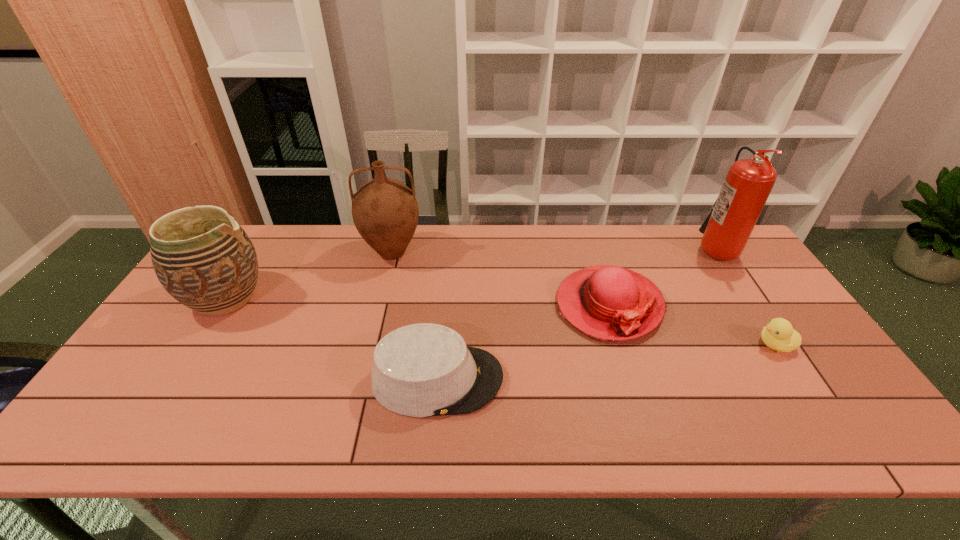
Locate an element on the screen. This screenshot has width=960, height=540. free region located 0.150m on the right of the pitcher is located at coordinates (468, 253).

Identify the location of free space located 0.240m on the front of the third tallest object. The image size is (960, 540). (159, 404).

Identify the location of free space located 0.050m at the front of the right hat with a bow. The image size is (960, 540). (626, 361).

You are a GUI agent. You are given a task and a screenshot of the screen. Output one action in this format:
    pyautogui.click(x=<x>, y=<y>)
    Task: Click on the free spot located 0.110m on the front-facing side of the left hat
    
    Given the screenshot: What is the action you would take?
    pyautogui.click(x=548, y=379)

Locate an element on the screen. This screenshot has width=960, height=540. vacant space situated 0.290m at the beak of the shortest object is located at coordinates (647, 345).

Find the location of `free location located at the beak of the shortest object`. free location located at the beak of the shortest object is located at coordinates (719, 345).

Where is `vacant space located at the beak of the shortest object`? vacant space located at the beak of the shortest object is located at coordinates (666, 345).

At what (x,y) coordinates should I click in order to perform the action: click on fire extinguisher that is at the far edge. Please return your answer as a coordinate pair (x, y). Image resolution: width=960 pixels, height=540 pixels. Looking at the image, I should click on (748, 184).

Where is `pitcher located at the far edge`? This screenshot has height=540, width=960. pitcher located at the far edge is located at coordinates (385, 211).

Where is `object at the near edge`? object at the near edge is located at coordinates (421, 370).